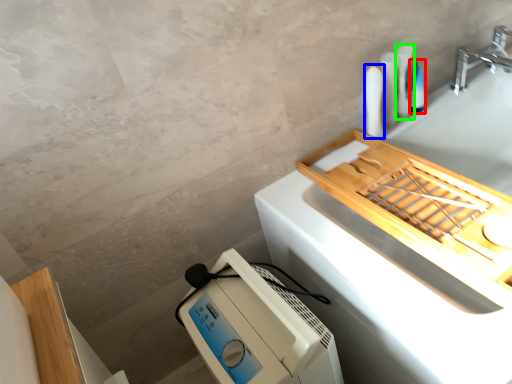
Question: Which object is the farthest from toiletry (highlighted by a red box)? Choose among these: toiletry (highlighted by a blue box) or toiletry (highlighted by a green box).

Choices:
 (A) toiletry
 (B) toiletry

Answer: (A)